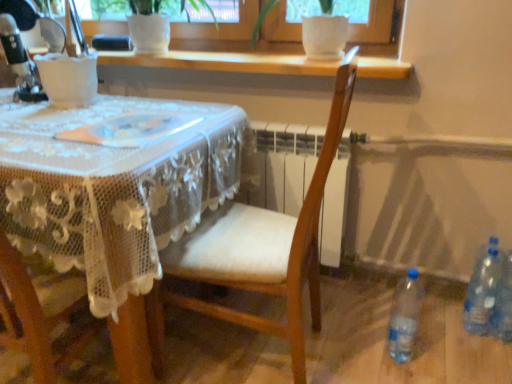
Question: Is clear plastic bottle at lower right, which ranks as the second bottle in right-to-left order, bigger or smaller than metallic silver sewing machine at upper left?

Choices:
 (A) big
 (B) small

Answer: (B)

Question: Relative to metallic silver sewing machine at upper left, is clear plastic bottle at lower right, which ranks as the second bottle in right-to-left order, in front or behind?

Choices:
 (A) behind
 (B) front

Answer: (B)

Question: Which object is the closest to the clear plastic bottle at lower right, which ranks as the second bottle in right-to-left order?

Choices:
 (A) transparent plastic bottle at lower right, the 1th bottle in the left-to-right sequence
 (B) clear plastic bottle at lower right, placed as the 1th bottle when sorted from right to left
 (C) white lace tablecloth at center
 (D) wooden chair at center
 (E) wooden at upper center

Answer: (B)

Question: Estimate the real-world distances between objects in this image. Which object is farther from the white plastic window frame at upper center?

Choices:
 (A) white lace tablecloth at center
 (B) metallic silver sewing machine at upper left
 (C) clear plastic bottle at lower right, which ranks as the second bottle in right-to-left order
 (D) white ceramic pot at upper center
 (E) transparent plastic bottle at lower right, the 1th bottle in the left-to-right sequence

Answer: (C)